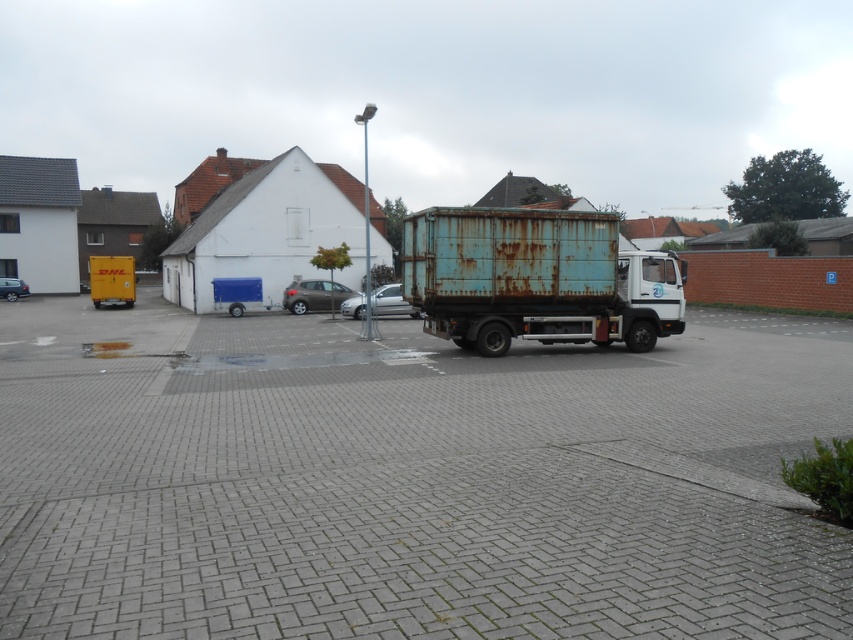
You are a delivery person trying to unload a package from the rusty metal truck at center. You need to move the satin brown hatchback at center to access the cargo area. Is the truck currently blocking the hatchback?

The rusty metal truck at center is positioned under the satin brown hatchback at center, which means the truck is blocking the hatchback, so you need to move the truck first to access the hatchback.

You are a delivery person trying to park a third vehicle between the satin brown hatchback at center and the silver metallic car at center. Based on their heights, which vehicle should you position closer to the ground to ensure proper clearance?

The satin brown hatchback at center is much taller than the silver metallic car at center, so you should position the silver metallic car at center closer to the ground to ensure proper clearance.